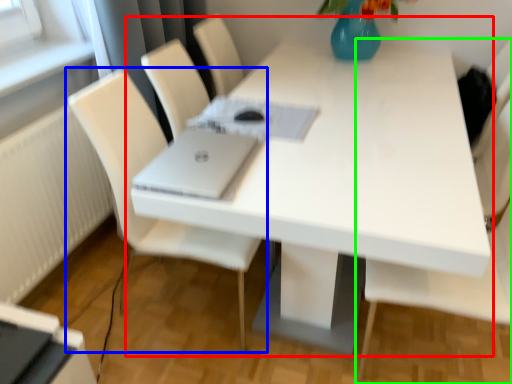
Question: Which object is positioned farthest from table (highlighted by a red box)? Select from chair (highlighted by a blue box) and chair (highlighted by a green box).

Choices:
 (A) chair
 (B) chair

Answer: (A)